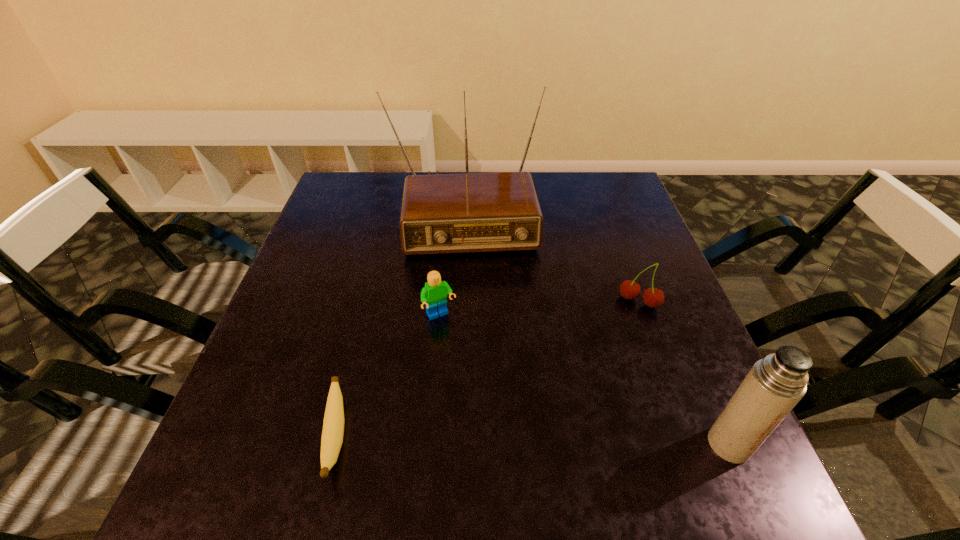
This screenshot has width=960, height=540. What are the coordinates of `banana` in the screenshot? It's located at coord(333,426).

The height and width of the screenshot is (540, 960). What are the coordinates of `the fourth shortest object` in the screenshot? It's located at (775, 384).

Where is `Lego`? Lego is located at coordinates tap(433, 295).

This screenshot has height=540, width=960. Find the location of `cherry`. cherry is located at coordinates (653, 297).

The width and height of the screenshot is (960, 540). Find the location of `the farthest object`. the farthest object is located at coordinates (474, 212).

Find the location of a particular element. radio_receiver is located at coordinates (474, 212).

Locate an element on the screen. This screenshot has width=960, height=540. free region located 0.280m on the back of the shortest object is located at coordinates (373, 286).

Find the location of a particular element. The width and height of the screenshot is (960, 540). free space located 0.260m on the left of the thermos bottle is located at coordinates (555, 444).

Identify the location of free space located on the face of the Lego. The width and height of the screenshot is (960, 540). click(x=490, y=399).

Locate an element on the screen. Image resolution: width=960 pixels, height=540 pixels. vacant space located 0.260m on the face of the Lego is located at coordinates (505, 426).